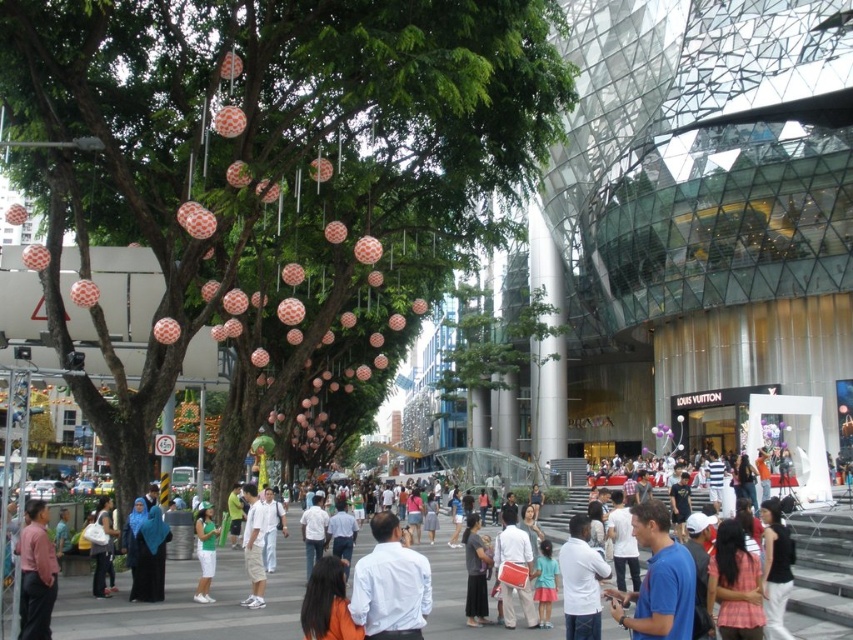
Is white matte shirt at center positioned behind white cotton shirt at center?

That is False.

Is white matte shirt at center positioned in front of white cotton shirt at center?

Yes, white matte shirt at center is in front of white cotton shirt at center.

The width and height of the screenshot is (853, 640). In order to click on white matte shirt at center in this screenshot , I will do `click(390, 586)`.

Does point (55, 557) come in front of point (206, 566)?

Yes.

Does matte pink shirt at lower left have a larger size compared to green fabric shorts at center?

Actually, matte pink shirt at lower left might be smaller than green fabric shorts at center.

I want to click on matte pink shirt at lower left, so click(36, 573).

Identify the location of matte pink shirt at lower left. Image resolution: width=853 pixels, height=640 pixels. (36, 573).

Looking at this image, does blue fabric hijab at center have a smaller size compared to green fabric shorts at center?

Indeed, blue fabric hijab at center has a smaller size compared to green fabric shorts at center.

Is blue fabric hijab at center shorter than green fabric shorts at center?

Correct, blue fabric hijab at center is not as tall as green fabric shorts at center.

Which is behind, point (148, 563) or point (202, 545)?

Positioned behind is point (202, 545).

Locate an element on the screen. The height and width of the screenshot is (640, 853). blue fabric hijab at center is located at coordinates (149, 557).